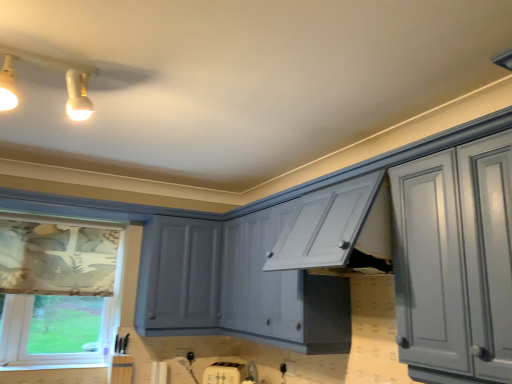
In order to face patterned fabric window at lower left, should I rotate leftwards or rightwards?

To align with it, rotate left about 24.584°.

Measure the distance between patterned fabric window at lower left and camera.

patterned fabric window at lower left is 8.90 feet from camera.

What do you see at coordinates (56, 289) in the screenshot? The image size is (512, 384). I see `patterned fabric window at lower left` at bounding box center [56, 289].

I want to click on patterned fabric window at lower left, so [56, 289].

Find the location of a particular element. patterned fabric window at lower left is located at coordinates (56, 289).